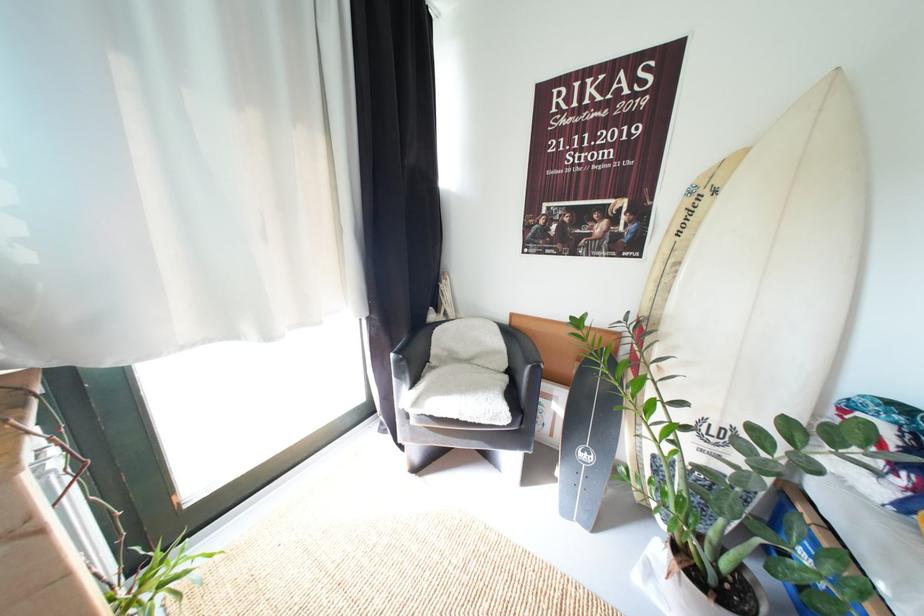
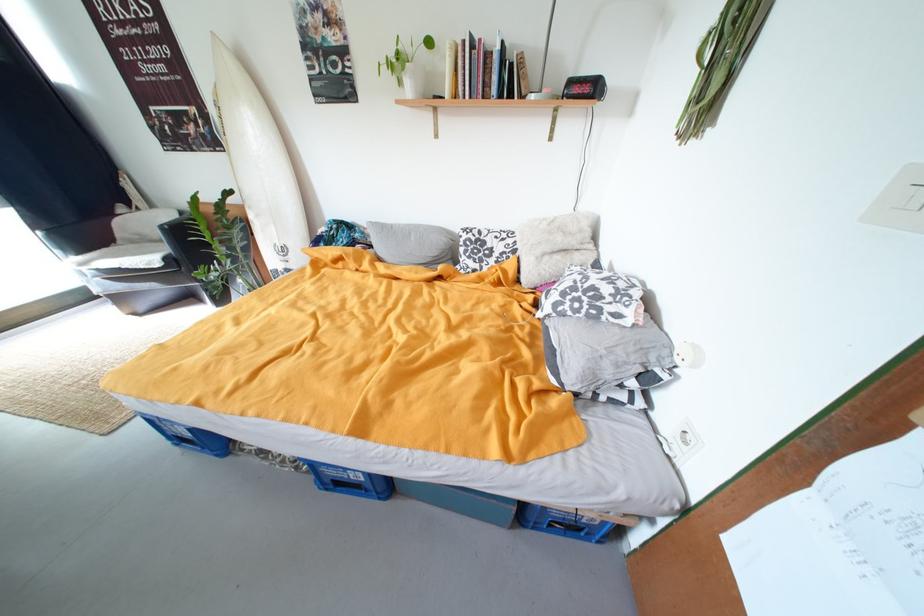
Locate, in the second image, the point that corresponds to (477,363) in the first image.

(169, 243)